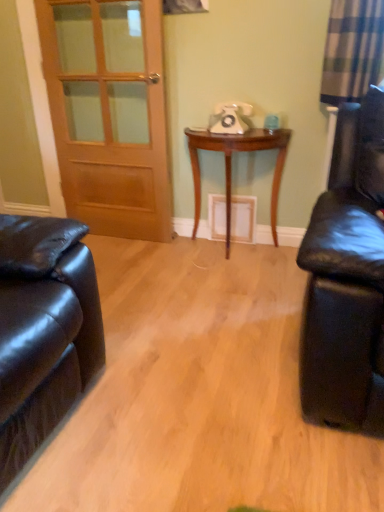
This screenshot has height=512, width=384. I want to click on vacant space in woodenmaterial/texturetable at center (from a real-world perspective), so click(x=228, y=251).